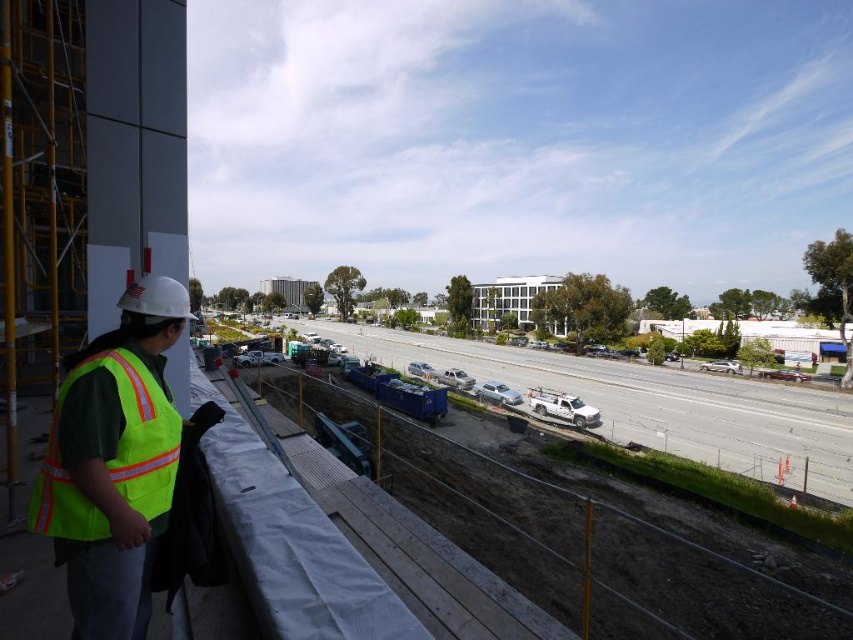
Question: Which point appears farthest from the camera in this image?

Choices:
 (A) (136, 336)
 (B) (140, 374)

Answer: (A)

Question: Does dirt at lower center have a larger size compared to high visibility reflective vest at left?

Choices:
 (A) yes
 (B) no

Answer: (A)

Question: Where is dirt at lower center located in relation to high visibility reflective vest at left in the image?

Choices:
 (A) below
 (B) above

Answer: (A)

Question: Considering the relative positions of high visibility reflective vest at left and high-visibility reflective safety vest at left in the image provided, where is high visibility reflective vest at left located with respect to high-visibility reflective safety vest at left?

Choices:
 (A) below
 (B) above

Answer: (B)

Question: Among these objects, which one is farthest from the camera?

Choices:
 (A) dirt at lower center
 (B) high-visibility reflective safety vest at left
 (C) high visibility reflective vest at left

Answer: (A)

Question: Which point is farther from the camera taking this photo?

Choices:
 (A) (734, 616)
 (B) (161, 440)

Answer: (A)